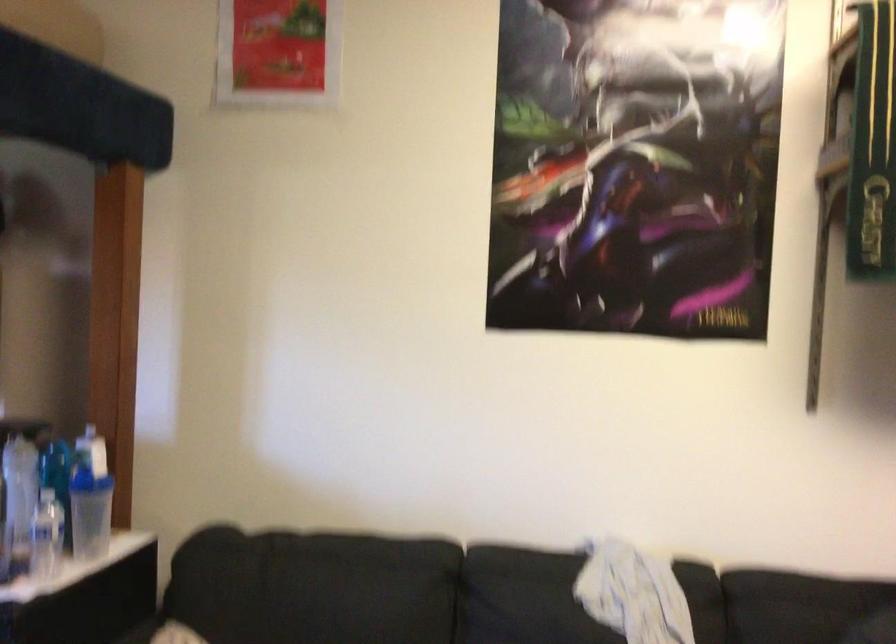
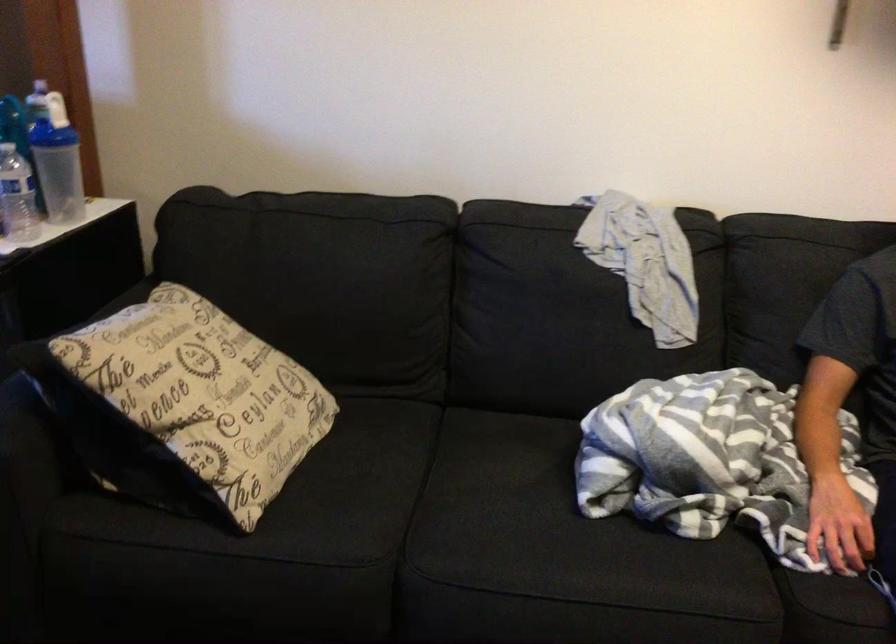
Locate, in the second image, the point that corresponds to point 90,506 in the first image.

(56, 161)